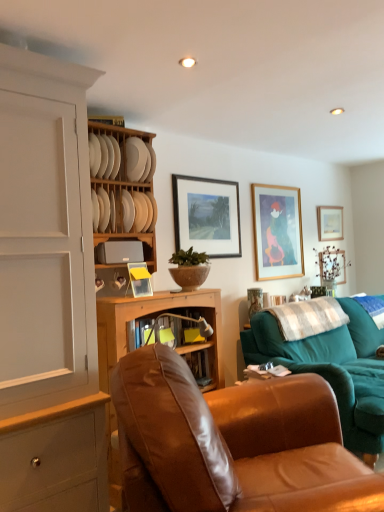
Question: Is the depth of wooden picture frame at upper right, which is the first picture frame in back-to-front order, less than that of teal fabric couch at right?

Choices:
 (A) no
 (B) yes

Answer: (A)

Question: Can you confirm if wooden picture frame at upper right, the 1th picture frame from the right, is bigger than teal fabric couch at right?

Choices:
 (A) no
 (B) yes

Answer: (A)

Question: Considering the relative sizes of wooden picture frame at upper right, the 1th picture frame from the right, and teal fabric couch at right in the image provided, is wooden picture frame at upper right, the 1th picture frame from the right, wider than teal fabric couch at right?

Choices:
 (A) no
 (B) yes

Answer: (A)

Question: Would you say teal fabric couch at right is part of wooden picture frame at upper right, which is the first picture frame in back-to-front order,'s contents?

Choices:
 (A) yes
 (B) no

Answer: (B)

Question: Does wooden picture frame at upper right, arranged as the 4th picture frame when viewed from the left, lie behind teal fabric couch at right?

Choices:
 (A) no
 (B) yes

Answer: (B)

Question: In terms of height, does white matte plate at upper center, acting as the second plate starting from the bottom, look taller or shorter compared to white matte plate at upper center, acting as the 2th plate starting from the top?

Choices:
 (A) short
 (B) tall

Answer: (A)

Question: Based on their sizes in the image, would you say white matte plate at upper center, arranged as the 1th plate when viewed from the top, is bigger or smaller than white matte plate at upper center, acting as the 2th plate starting from the top?

Choices:
 (A) small
 (B) big

Answer: (A)

Question: Looking at their shapes, would you say white matte plate at upper center, acting as the second plate starting from the bottom, is wider or thinner than white matte plate at upper center, the 1th plate in the bottom-to-top sequence?

Choices:
 (A) wide
 (B) thin

Answer: (B)

Question: Is white matte plate at upper center, arranged as the 1th plate when viewed from the top, in front of or behind white matte plate at upper center, the 1th plate in the bottom-to-top sequence, in the image?

Choices:
 (A) front
 (B) behind

Answer: (B)

Question: Is wooden-framed painting at center, positioned as the fourth picture frame in back-to-front order, taller or shorter than white matte plate at upper center, acting as the second plate starting from the bottom?

Choices:
 (A) tall
 (B) short

Answer: (A)

Question: Considering the positions of wooden-framed painting at center, which is the first picture frame from left to right, and white matte plate at upper center, acting as the second plate starting from the bottom, in the image, is wooden-framed painting at center, which is the first picture frame from left to right, bigger or smaller than white matte plate at upper center, acting as the second plate starting from the bottom,?

Choices:
 (A) big
 (B) small

Answer: (A)

Question: Is wooden-framed painting at center, marked as the first picture frame in a front-to-back arrangement, in front of or behind white matte plate at upper center, arranged as the 1th plate when viewed from the top, in the image?

Choices:
 (A) front
 (B) behind

Answer: (B)

Question: From the image's perspective, is wooden-framed painting at center, marked as the first picture frame in a front-to-back arrangement, above or below white matte plate at upper center, arranged as the 1th plate when viewed from the top?

Choices:
 (A) above
 (B) below

Answer: (B)

Question: Looking at the image, does wooden-framed painting at center, positioned as the fourth picture frame in back-to-front order, seem bigger or smaller compared to white checkered fabric at right, which is the first pillow from left to right?

Choices:
 (A) small
 (B) big

Answer: (A)

Question: From their relative heights in the image, would you say wooden-framed painting at center, marked as the 4th picture frame in a right-to-left arrangement, is taller or shorter than white checkered fabric at right, the first pillow from the front?

Choices:
 (A) tall
 (B) short

Answer: (A)